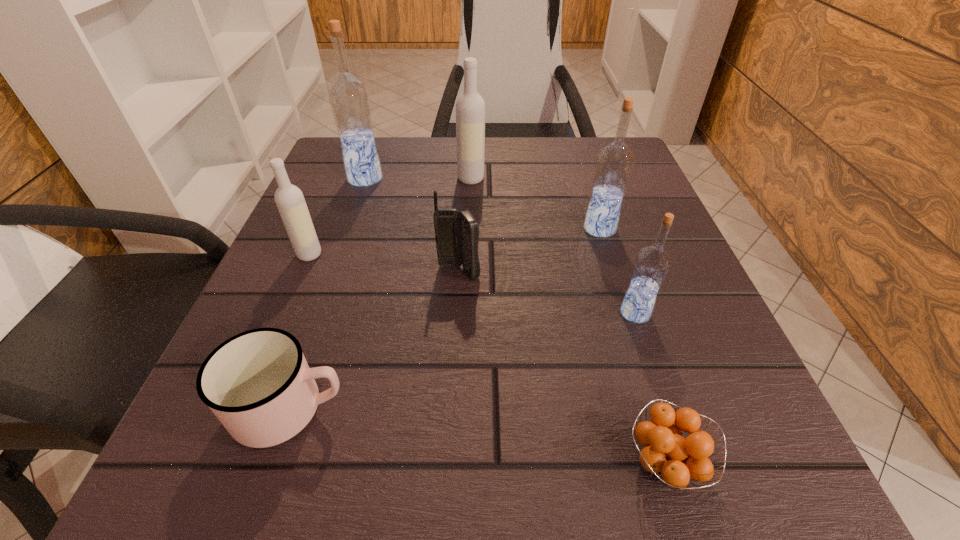
Identify the location of the tallest object. (349, 99).

This screenshot has height=540, width=960. Identify the location of the biggest blue vodka. (349, 99).

Where is `the third vodka from left to right`? This screenshot has width=960, height=540. the third vodka from left to right is located at coordinates (470, 107).

Image resolution: width=960 pixels, height=540 pixels. Find the location of `the right white vodka`. the right white vodka is located at coordinates (470, 107).

Where is `the third farthest vodka`? the third farthest vodka is located at coordinates (614, 163).

Locate an element on the screen. The image size is (960, 540). the second biggest blue vodka is located at coordinates (614, 163).

You are a GUI agent. You are given a task and a screenshot of the screen. Output one action in this format:
    pyautogui.click(x=<x>, y=<y>)
    Task: Click on the nearer white vodka
    
    Given the screenshot: What is the action you would take?
    pyautogui.click(x=289, y=199)

Find the location of a particular element. The height and width of the screenshot is (540, 960). the smaller white vodka is located at coordinates (289, 199).

The height and width of the screenshot is (540, 960). Identify the location of the nearest blue vodka. (652, 263).

At what (x,y) coordinates should I click in order to perform the action: click on the nearest vodka. Please return your answer as a coordinate pair (x, y). Looking at the image, I should click on (652, 263).